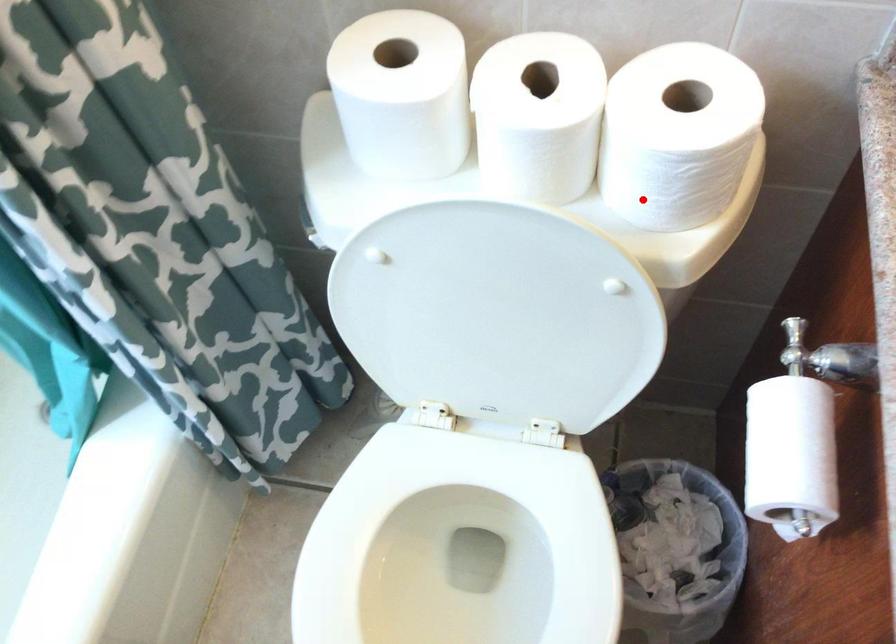
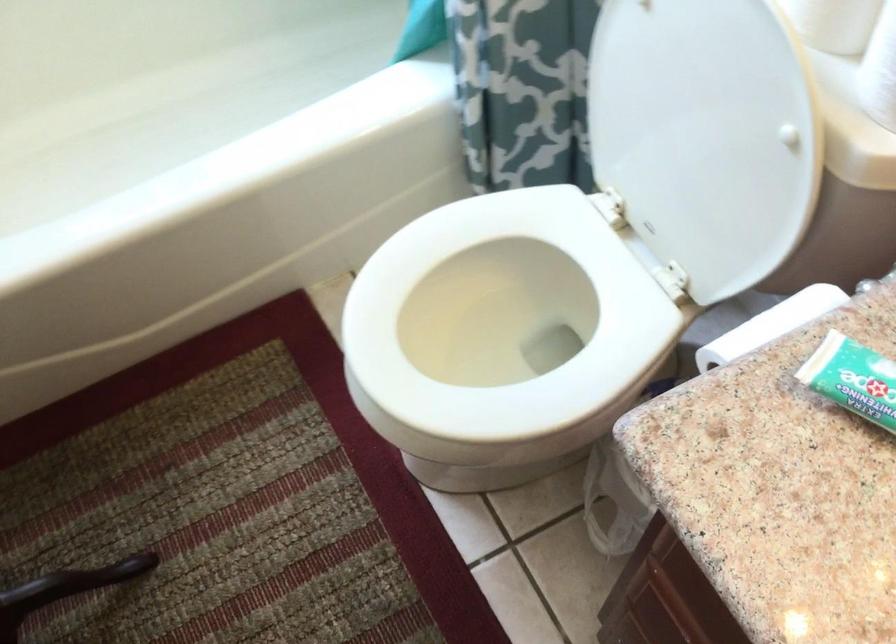
In the second image, find the point that corresponds to the highlighted location in the first image.

(880, 70)